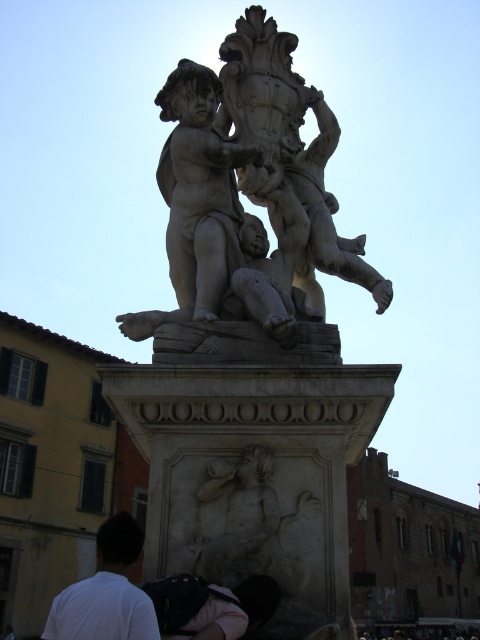
From the picture: Is white marble cherub at center closer to the viewer compared to white matte shirt at lower left?

That is False.

Is white marble cherub at center wider than white matte shirt at lower left?

No, white marble cherub at center is not wider than white matte shirt at lower left.

Locate an element on the screen. The height and width of the screenshot is (640, 480). white marble cherub at center is located at coordinates (200, 192).

You are a GUI agent. You are given a task and a screenshot of the screen. Output one action in this format:
    pyautogui.click(x=<x>, y=<y>)
    Task: Click on the white marble cherub at center
    
    Given the screenshot: What is the action you would take?
    pyautogui.click(x=200, y=192)

Does white marble sculpture at upper center come in front of white matte shirt at lower left?

No, white marble sculpture at upper center is behind white matte shirt at lower left.

Describe the element at coordinates (248, 212) in the screenshot. I see `white marble sculpture at upper center` at that location.

What are the coordinates of `white marble sculpture at upper center` in the screenshot? It's located at (248, 212).

Which is above, white marble sculpture at upper center or white marble cherub at center?

white marble sculpture at upper center is above.

Is white marble sculpture at upper center positioned before white marble cherub at center?

Yes.

Find the location of `white marble sculpture at upper center`. white marble sculpture at upper center is located at coordinates (248, 212).